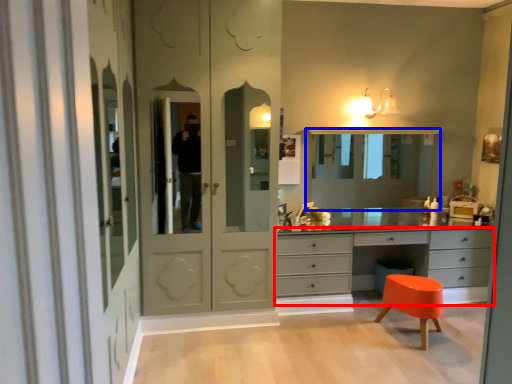
Question: Among these objects, which one is nearest to the camera, chest of drawers (highlighted by a red box) or medicine cabinet (highlighted by a blue box)?

Choices:
 (A) chest of drawers
 (B) medicine cabinet

Answer: (A)